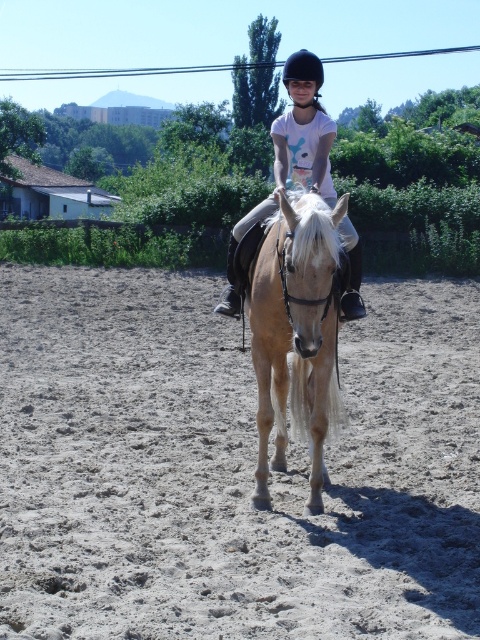
You are a safety inspector checking the arena setup. You notice the light brown sandy ground at center and the black hard helmet at center. According to safety regulations, the helmet must be positioned above the ground to ensure proper protection. Is this requirement met in the current setup?

The light brown sandy ground at center is located below the black hard helmet at center, so the helmet is positioned above the ground as required by safety regulations.

You are a horse trainer observing the light brown glossy horse at center and the light brown sandy ground at center in the arena. Which object is closer to the ground?

The light brown glossy horse at center is positioned over the light brown sandy ground at center, so the light brown sandy ground at center is closer to the ground.

You are standing at the point marked as point (432, 396) in the arena. You want to throw a small ball to a friend who is standing exactly where the viewer is positioned. If your throwing range is 30 feet, will you be able to reach them?

The distance between point (432, 396) and the viewer is 32.67 feet. Since your throwing range is 30 feet, you cannot reach them.